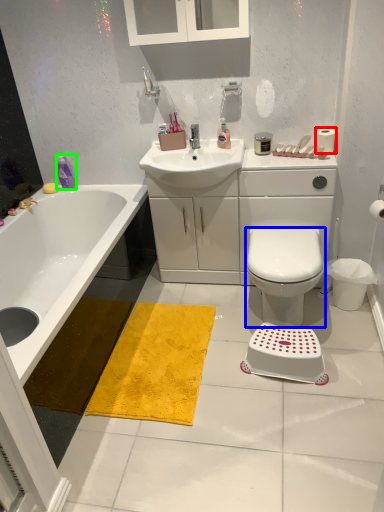
Question: Estimate the real-world distances between objects in this image. Which object is farther from toilet paper (highlighted by a red box), bidet (highlighted by a blue box) or toiletry (highlighted by a green box)?

Choices:
 (A) bidet
 (B) toiletry

Answer: (B)